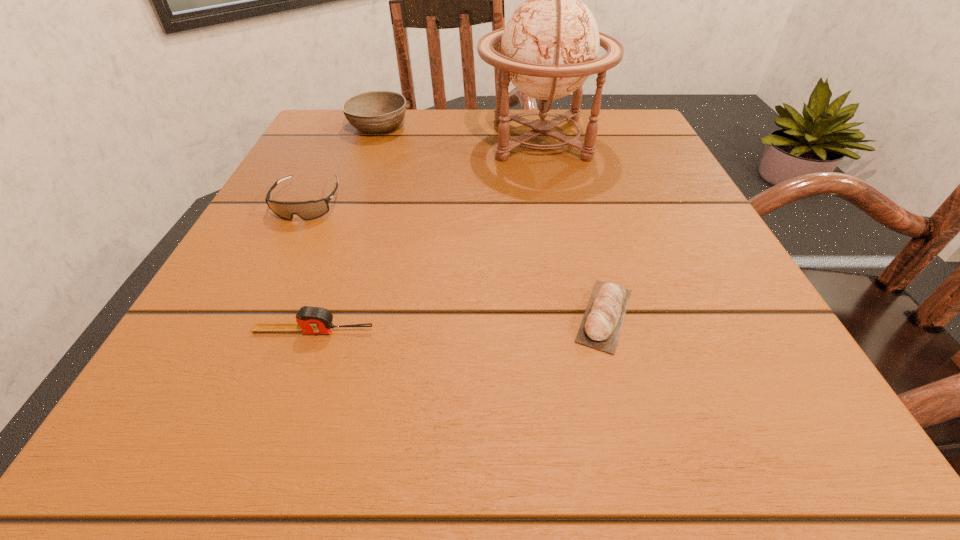
At what (x,y) coordinates should I click in order to perform the action: click on vacant area that satisfies the following two spatial constraints: 1. on the front-facing side of the shortest object; 2. on the left side of the tallest object. Please return your answer as a coordinate pair (x, y). Looking at the image, I should click on (577, 315).

Identify the location of free space that satisfies the following two spatial constraints: 1. on the front-facing side of the pita bread; 2. on the left side of the tallest object. Image resolution: width=960 pixels, height=540 pixels. point(577,315).

At what (x,y) coordinates should I click in order to perform the action: click on free location that satisfies the following two spatial constraints: 1. on the lenses of the shortest object; 2. on the right side of the goggles. Please return your answer as a coordinate pair (x, y). The height and width of the screenshot is (540, 960). Looking at the image, I should click on (252, 315).

The width and height of the screenshot is (960, 540). Identify the location of free space in the image that satisfies the following two spatial constraints: 1. on the front-facing side of the tallest object; 2. on the lenses of the goggles. (554, 203).

In order to click on free location that satisfies the following two spatial constraints: 1. on the front side of the second tallest object; 2. on the left side of the pita bread in this screenshot , I will do `click(308, 315)`.